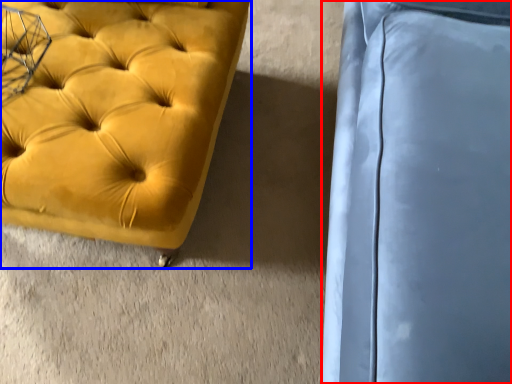
Question: Which object appears farthest to the camera in this image, swivel chair (highlighted by a red box) or furniture (highlighted by a blue box)?

Choices:
 (A) swivel chair
 (B) furniture

Answer: (B)